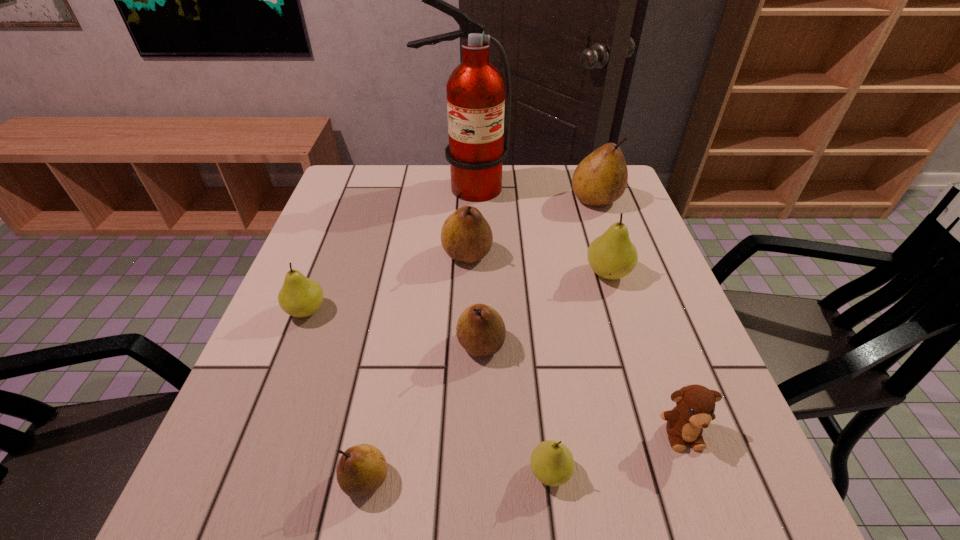
Locate an element on the screen. green pear that can be found as the second closest to the second smallest brown pear is located at coordinates (612, 256).

This screenshot has width=960, height=540. Identify the location of vacant region that satisfies the following two spatial constraints: 1. on the nozzle and handle of the third nearest brown pear; 2. on the left side of the tallest object. (462, 254).

The width and height of the screenshot is (960, 540). I want to click on free spot that satisfies the following two spatial constraints: 1. on the nozzle and handle of the tallest object; 2. on the right side of the rightmost brown pear, so click(465, 200).

Image resolution: width=960 pixels, height=540 pixels. What are the coordinates of `blank space that satisfies the following two spatial constraints: 1. on the back side of the second biggest green pear; 2. on the right side of the biggest brown pear` in the screenshot? It's located at (349, 200).

Where is `vacant space that satisfies the following two spatial constraints: 1. on the nozzle and handle of the tallest object; 2. on the left side of the third farthest brown pear`? This screenshot has height=540, width=960. vacant space that satisfies the following two spatial constraints: 1. on the nozzle and handle of the tallest object; 2. on the left side of the third farthest brown pear is located at coordinates (457, 345).

Locate an element on the screen. Image resolution: width=960 pixels, height=540 pixels. free spot that satisfies the following two spatial constraints: 1. on the back side of the eighth shortest object; 2. on the left side of the leftmost object is located at coordinates (349, 200).

Where is `free region that satisfies the following two spatial constraints: 1. on the back side of the leftmost brown pear; 2. on the right side of the second farthest brown pear`? The width and height of the screenshot is (960, 540). free region that satisfies the following two spatial constraints: 1. on the back side of the leftmost brown pear; 2. on the right side of the second farthest brown pear is located at coordinates (408, 254).

Image resolution: width=960 pixels, height=540 pixels. Find the location of `vacant space that satisfies the following two spatial constraints: 1. on the nozzle and handle of the fire extinguisher; 2. on the right side of the second nearest brown pear`. vacant space that satisfies the following two spatial constraints: 1. on the nozzle and handle of the fire extinguisher; 2. on the right side of the second nearest brown pear is located at coordinates (457, 345).